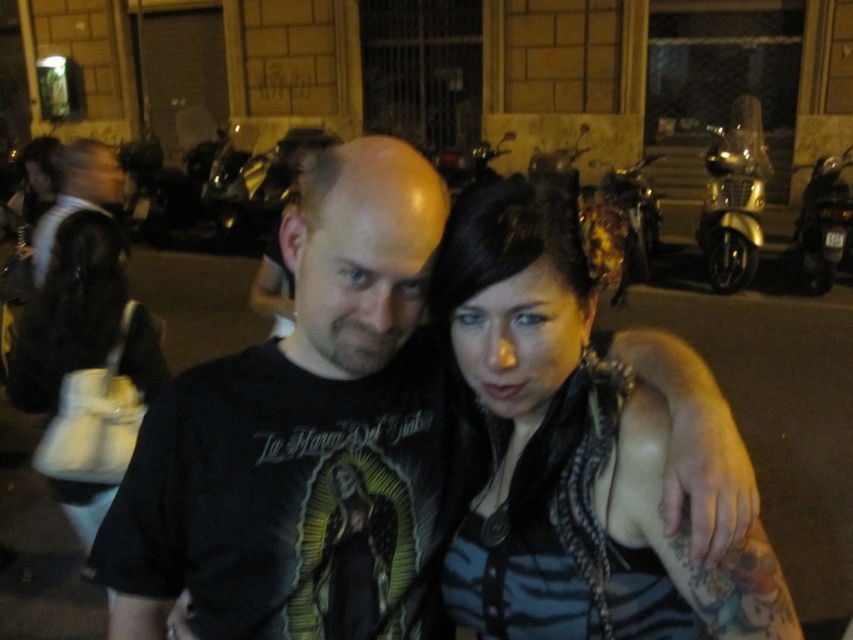
Between metallic silver scooter at right and shiny chrome scooter at center, which one appears on the right side from the viewer's perspective?

From the viewer's perspective, metallic silver scooter at right appears more on the right side.

Who is higher up, metallic silver scooter at right or shiny chrome scooter at center?

Positioned higher is metallic silver scooter at right.

Which is behind, point (804, 243) or point (653, 256)?

The point (653, 256) is behind.

This screenshot has height=640, width=853. I want to click on metallic silver scooter at right, so click(822, 221).

Between dark brown leather jacket at center and shiny chrome scooter at center, which one appears on the right side from the viewer's perspective?

shiny chrome scooter at center

Is dark brown leather jacket at center below shiny chrome scooter at center?

Correct, dark brown leather jacket at center is located below shiny chrome scooter at center.

Who is more distant from viewer, (x=712, y=611) or (x=639, y=230)?

The point (x=639, y=230) is behind.

Locate an element on the screen. dark brown leather jacket at center is located at coordinates (570, 448).

Can you confirm if black matte shirt at center is taller than gold metallic scooter at upper right?

No.

Which is behind, point (726, 406) or point (740, 250)?

The point (740, 250) is more distant.

I want to click on black matte shirt at center, so click(288, 412).